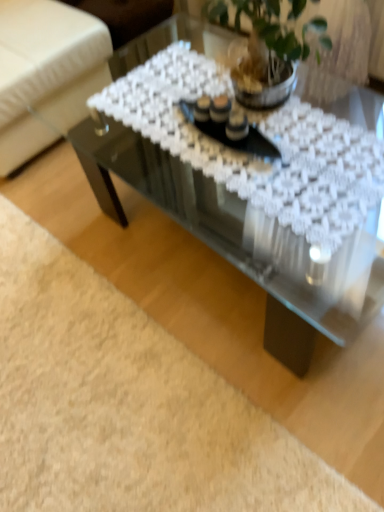
Question: Is transparent glass coffee table at center at the right side of white fabric armchair at upper left?

Choices:
 (A) yes
 (B) no

Answer: (A)

Question: From a real-world perspective, is transparent glass coffee table at center below white fabric armchair at upper left?

Choices:
 (A) no
 (B) yes

Answer: (B)

Question: From the image's perspective, is transparent glass coffee table at center below white fabric armchair at upper left?

Choices:
 (A) no
 (B) yes

Answer: (B)

Question: Is transparent glass coffee table at center positioned with its back to white fabric armchair at upper left?

Choices:
 (A) no
 (B) yes

Answer: (A)

Question: Is transparent glass coffee table at center completely or partially outside of white fabric armchair at upper left?

Choices:
 (A) no
 (B) yes

Answer: (B)

Question: From a real-world perspective, is clear glass plate at center above or below white fabric armchair at upper left?

Choices:
 (A) above
 (B) below

Answer: (A)

Question: Considering the positions of point (256, 152) and point (23, 44), is point (256, 152) closer or farther from the camera than point (23, 44)?

Choices:
 (A) closer
 (B) farther

Answer: (A)

Question: Looking at their shapes, would you say clear glass plate at center is wider or thinner than white fabric armchair at upper left?

Choices:
 (A) thin
 (B) wide

Answer: (A)

Question: Choose the correct answer: Is clear glass plate at center inside white fabric armchair at upper left or outside it?

Choices:
 (A) inside
 (B) outside

Answer: (B)

Question: Is point (340, 337) closer or farther from the camera than point (210, 124)?

Choices:
 (A) farther
 (B) closer

Answer: (A)

Question: Based on their positions, is transparent glass coffee table at center located to the left or right of clear glass plate at center?

Choices:
 (A) left
 (B) right

Answer: (B)

Question: Looking at the image, does transparent glass coffee table at center seem bigger or smaller compared to clear glass plate at center?

Choices:
 (A) big
 (B) small

Answer: (A)

Question: Looking at their shapes, would you say transparent glass coffee table at center is wider or thinner than clear glass plate at center?

Choices:
 (A) wide
 (B) thin

Answer: (A)

Question: Is transparent glass coffee table at center wider or thinner than white fabric armchair at upper left?

Choices:
 (A) thin
 (B) wide

Answer: (A)

Question: Considering the positions of point (114, 140) and point (31, 69), is point (114, 140) closer or farther from the camera than point (31, 69)?

Choices:
 (A) closer
 (B) farther

Answer: (A)